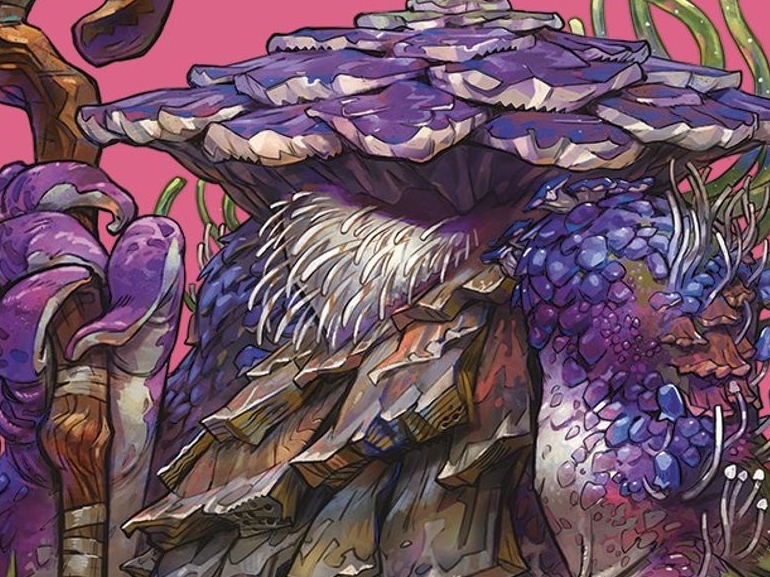
I want to click on reddish brown plates, so click(x=684, y=329), click(x=694, y=355), click(x=710, y=394), click(x=748, y=391), click(x=742, y=350), click(x=715, y=305), click(x=735, y=292).